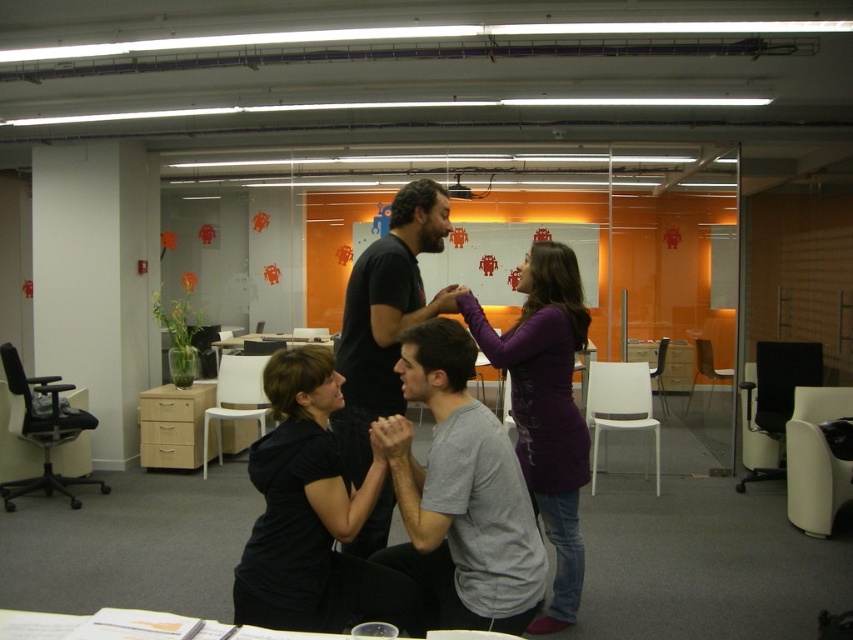
Is gray cotton shirt at center closer to the viewer compared to purple matte shirt at upper center?

Yes, gray cotton shirt at center is in front of purple matte shirt at upper center.

Locate an element on the screen. The height and width of the screenshot is (640, 853). gray cotton shirt at center is located at coordinates (460, 493).

Where is `gray cotton shirt at center`? This screenshot has width=853, height=640. gray cotton shirt at center is located at coordinates (460, 493).

What are the coordinates of `gray cotton shirt at center` in the screenshot? It's located at (460, 493).

Is black matte shirt at center to the right of purple matte shirt at upper center from the viewer's perspective?

Incorrect, black matte shirt at center is not on the right side of purple matte shirt at upper center.

Is black matte shirt at center above purple matte shirt at upper center?

No.

The width and height of the screenshot is (853, 640). What do you see at coordinates (312, 515) in the screenshot? I see `black matte shirt at center` at bounding box center [312, 515].

The image size is (853, 640). I want to click on black matte shirt at center, so coord(312,515).

Is gray cotton shirt at center taller than black matte shirt at center?

Yes, gray cotton shirt at center is taller than black matte shirt at center.

Is gray cotton shirt at center smaller than black matte shirt at center?

Correct, gray cotton shirt at center occupies less space than black matte shirt at center.

Where is `gray cotton shirt at center`? gray cotton shirt at center is located at coordinates (460, 493).